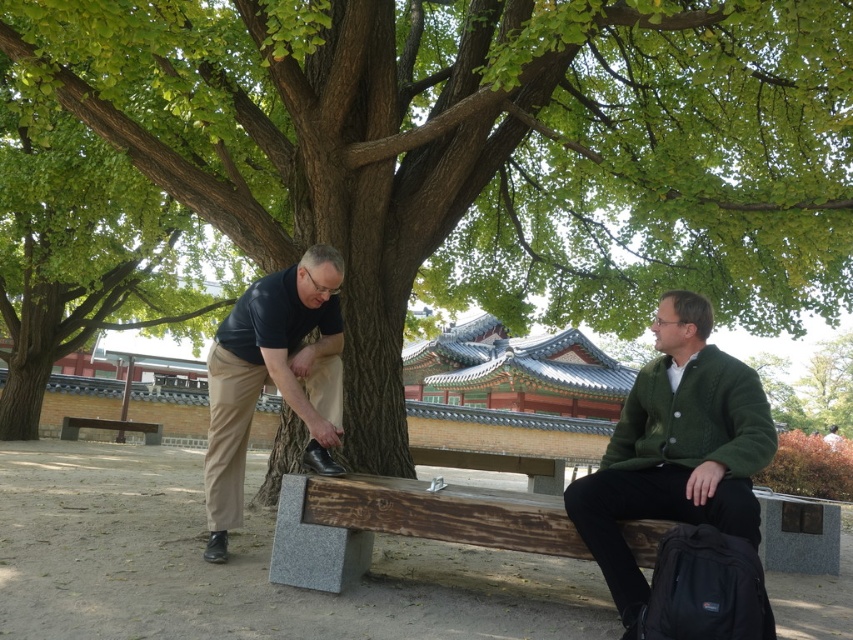
Question: Can you confirm if green leafy tree at upper left is wider than wooden bench at lower left?

Choices:
 (A) no
 (B) yes

Answer: (B)

Question: Which of the following is the farthest from the observer?

Choices:
 (A) wooden bench at lower left
 (B) green leafy tree at upper left
 (C) dark blue shirt at left
 (D) green knitted sweater at right

Answer: (A)

Question: From the image, what is the correct spatial relationship of green leafy tree at upper left in relation to dark blue shirt at left?

Choices:
 (A) right
 (B) left

Answer: (B)

Question: Which of the following is the farthest from the observer?

Choices:
 (A) (144, 440)
 (B) (276, 292)
 (C) (61, 316)

Answer: (A)

Question: Which point is closer to the camera?

Choices:
 (A) dark blue shirt at left
 (B) green knitted sweater at right
 (C) wooden bench at lower left

Answer: (B)

Question: Does wooden bench at center come behind dark blue shirt at left?

Choices:
 (A) no
 (B) yes

Answer: (A)